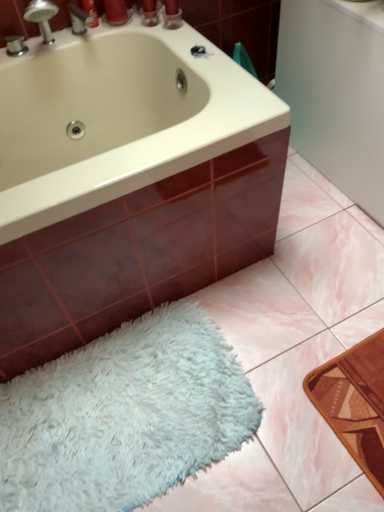
Measure the distance between brushed metal faucet at upper left and camera.

brushed metal faucet at upper left is 1.32 meters away from camera.

The image size is (384, 512). What are the coordinates of `brushed metal faucet at upper left` in the screenshot? It's located at (79, 19).

This screenshot has height=512, width=384. I want to click on white fluffy bath mat at lower left, so click(124, 415).

Between white fluffy bath mat at lower left and brushed metal faucet at upper left, which one has more height?

Standing taller between the two is brushed metal faucet at upper left.

Considering the positions of point (209, 426) and point (86, 31), is point (209, 426) closer or farther from the camera than point (86, 31)?

Clearly, point (209, 426) is closer to the camera than point (86, 31).

Between white fluffy bath mat at lower left and brushed metal faucet at upper left, which one has smaller width?

brushed metal faucet at upper left.

Looking at the image, does white fluffy bath mat at lower left seem bigger or smaller compared to brushed metal faucet at upper left?

Clearly, white fluffy bath mat at lower left is larger in size than brushed metal faucet at upper left.

From the image's perspective, is white fluffy bath mat at lower left below white glossy bathtub at upper left?

Correct, white fluffy bath mat at lower left appears lower than white glossy bathtub at upper left in the image.

From a real-world perspective, between white fluffy bath mat at lower left and white glossy bathtub at upper left, who is vertically higher?

white glossy bathtub at upper left is physically above.

What's the angular difference between white fluffy bath mat at lower left and white glossy bathtub at upper left's facing directions?

90.2 degrees.

Find the location of a particular element. tap above the white glossy bathtub at upper left (from the image's perspective) is located at coordinates (79, 19).

Could you tell me if brushed metal faucet at upper left is facing white glossy bathtub at upper left?

No, brushed metal faucet at upper left is not facing towards white glossy bathtub at upper left.

Does brushed metal faucet at upper left appear on the right side of white glossy bathtub at upper left?

Incorrect, brushed metal faucet at upper left is not on the right side of white glossy bathtub at upper left.

Consider the image. From a real-world perspective, who is located higher, brushed metal faucet at upper left or white glossy bathtub at upper left?

brushed metal faucet at upper left.

From a real-world perspective, is brushed metal faucet at upper left over white fluffy bath mat at lower left?

Yes, from a real-world perspective, brushed metal faucet at upper left is above white fluffy bath mat at lower left.

How different are the orientations of brushed metal faucet at upper left and white fluffy bath mat at lower left in degrees?

The facing directions of brushed metal faucet at upper left and white fluffy bath mat at lower left are 90.1 degrees apart.

Is brushed metal faucet at upper left inside the boundaries of white fluffy bath mat at lower left, or outside?

brushed metal faucet at upper left lies outside white fluffy bath mat at lower left.

Which is more to the left, brushed metal faucet at upper left or white fluffy bath mat at lower left?

From the viewer's perspective, brushed metal faucet at upper left appears more on the left side.

From a real-world perspective, is white glossy bathtub at upper left positioned over white fluffy bath mat at lower left based on gravity?

Yes, from a real-world perspective, white glossy bathtub at upper left is over white fluffy bath mat at lower left

Considering their positions, is white glossy bathtub at upper left located in front of or behind white fluffy bath mat at lower left?

white glossy bathtub at upper left is in front of white fluffy bath mat at lower left.

Identify the location of bath mat below the white glossy bathtub at upper left (from a real-world perspective). (124, 415).

Considering the sizes of objects white glossy bathtub at upper left and white fluffy bath mat at lower left in the image provided, who is smaller, white glossy bathtub at upper left or white fluffy bath mat at lower left?

white fluffy bath mat at lower left.

Would you say white glossy bathtub at upper left contains brushed metal faucet at upper left?

Yes, white glossy bathtub at upper left is surrounding brushed metal faucet at upper left.

Considering the points (248, 126) and (77, 25), which point is in front, point (248, 126) or point (77, 25)?

The point (248, 126) is in front.

From the image's perspective, is white glossy bathtub at upper left above brushed metal faucet at upper left?

No, from the image's perspective, white glossy bathtub at upper left is not on top of brushed metal faucet at upper left.

From a real-world perspective, is white glossy bathtub at upper left located higher than brushed metal faucet at upper left?

Actually, white glossy bathtub at upper left is physically below brushed metal faucet at upper left in the real world.

I want to click on tap located above the white fluffy bath mat at lower left (from the image's perspective), so click(79, 19).

Image resolution: width=384 pixels, height=512 pixels. In order to click on bathtub on the left of white fluffy bath mat at lower left in this screenshot , I will do `click(117, 118)`.

When comparing their distances from white fluffy bath mat at lower left, does white glossy bathtub at upper left or brushed metal faucet at upper left seem closer?

white glossy bathtub at upper left is closer to white fluffy bath mat at lower left.

Considering their positions, is brushed metal faucet at upper left positioned closer to white glossy bathtub at upper left than white fluffy bath mat at lower left?

brushed metal faucet at upper left is positioned closer to the anchor white glossy bathtub at upper left.

Estimate the real-world distances between objects in this image. Which object is closer to white fluffy bath mat at lower left, brushed metal faucet at upper left or white glossy bathtub at upper left?

white glossy bathtub at upper left is positioned closer to the anchor white fluffy bath mat at lower left.

Which object lies nearer to the anchor point brushed metal faucet at upper left, white fluffy bath mat at lower left or white glossy bathtub at upper left?

white glossy bathtub at upper left.

Based on their spatial positions, is white glossy bathtub at upper left or white fluffy bath mat at lower left closer to brushed metal faucet at upper left?

white glossy bathtub at upper left lies closer to brushed metal faucet at upper left than the other object.

Consider the image. When comparing their distances from white glossy bathtub at upper left, does white fluffy bath mat at lower left or brushed metal faucet at upper left seem further?

The object further to white glossy bathtub at upper left is white fluffy bath mat at lower left.

Locate an element on the screen. This screenshot has height=512, width=384. bathtub between brushed metal faucet at upper left and white fluffy bath mat at lower left from top to bottom is located at coordinates (117, 118).